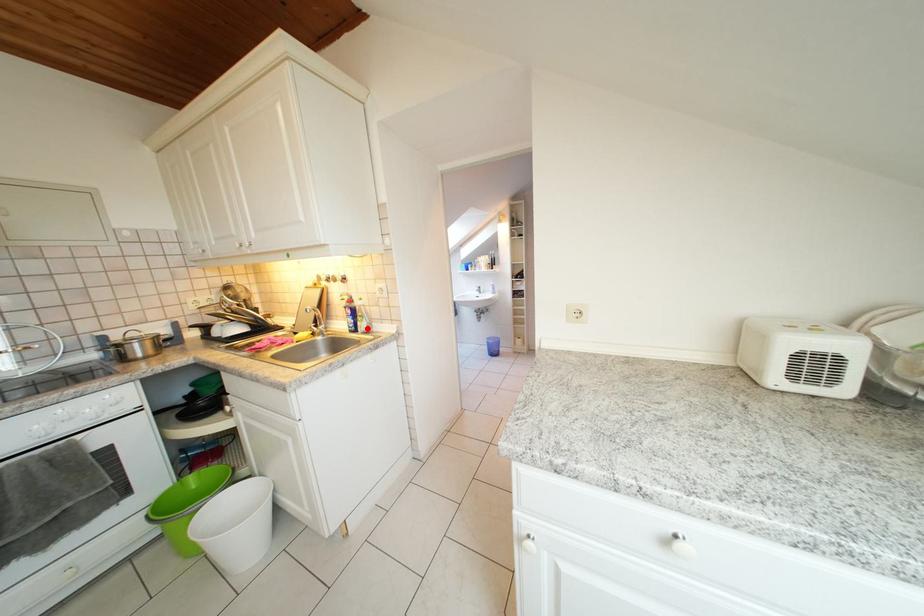
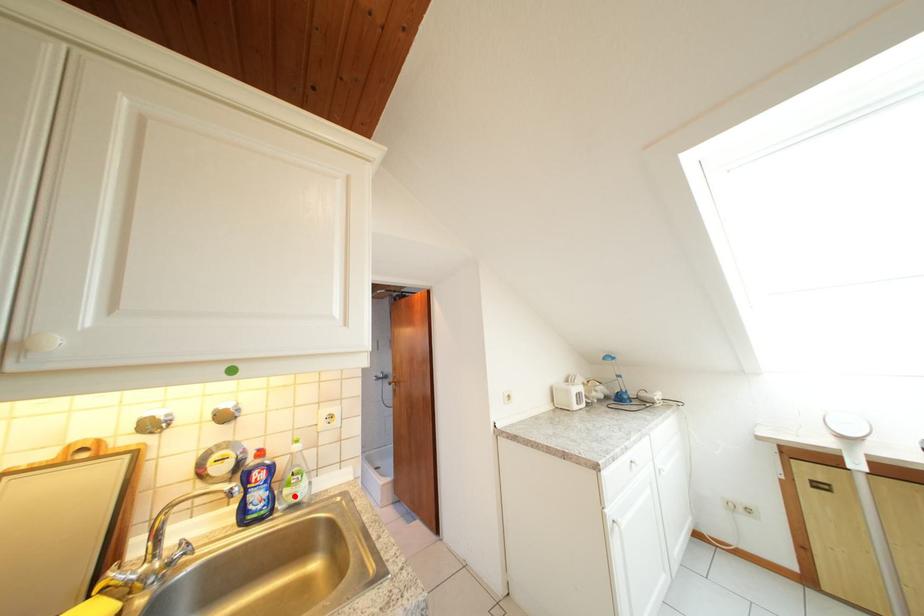
I am providing you with two images of the same scene from different viewpoints. A red point is marked on the first image and another point is marked on the second image. Does the point marked in image1 correspond to the same location as the one in image2?

Yes